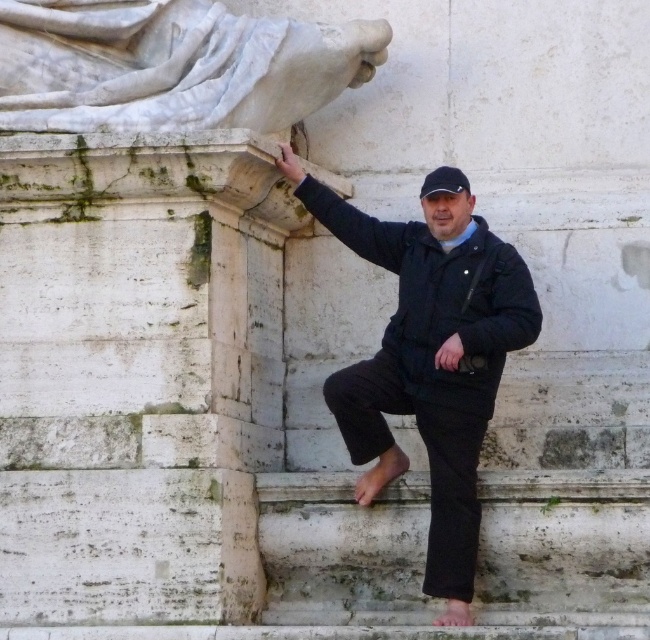
Question: Can you confirm if black matte jacket at center is positioned below white marble statue at upper left?

Choices:
 (A) yes
 (B) no

Answer: (A)

Question: Estimate the real-world distances between objects in this image. Which object is farther from the black matte jacket at center?

Choices:
 (A) black fabric baseball hat at upper center
 (B) white marble statue at upper left

Answer: (B)

Question: Can you confirm if black matte jacket at center is smaller than white marble statue at upper left?

Choices:
 (A) no
 (B) yes

Answer: (A)

Question: Which point appears closest to the camera in this image?

Choices:
 (A) (146, 42)
 (B) (462, 202)

Answer: (B)

Question: Where is black matte jacket at center located in relation to black fabric baseball hat at upper center in the image?

Choices:
 (A) below
 (B) above

Answer: (A)

Question: Which of the following is the farthest from the observer?

Choices:
 (A) (497, 248)
 (B) (456, 193)
 (C) (218, 61)

Answer: (C)